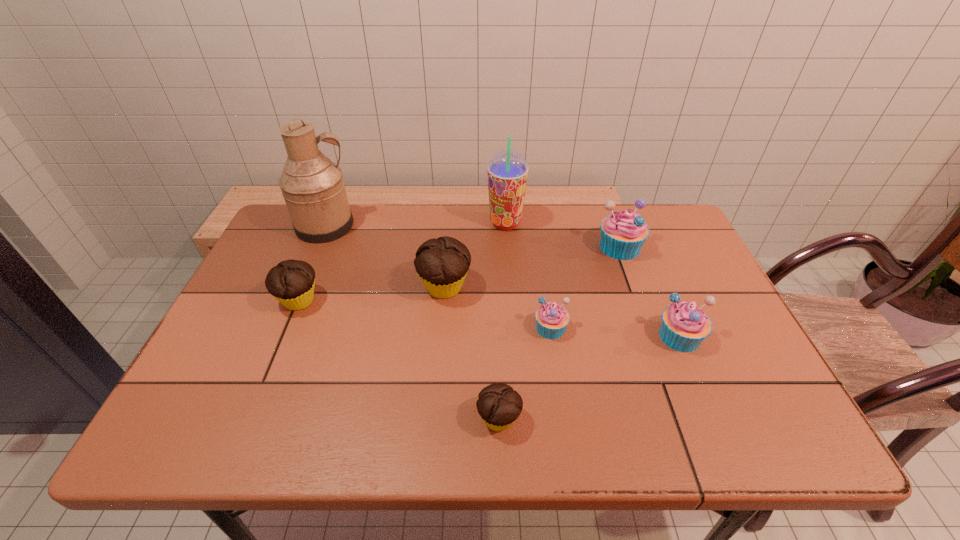
Identify the location of vacant region located 0.170m on the right of the third muffin from left to right. (605, 420).

Locate an element on the screen. The image size is (960, 540). pitcher at the far edge is located at coordinates (313, 188).

In order to click on smoothie present at the far edge in this screenshot , I will do `click(507, 170)`.

I want to click on muffin located at the far edge, so click(623, 233).

Where is `object that is at the near edge`? This screenshot has width=960, height=540. object that is at the near edge is located at coordinates (499, 405).

Identify the location of pitcher that is at the left edge. point(313,188).

The height and width of the screenshot is (540, 960). What are the coordinates of `muffin located at the left edge` in the screenshot? It's located at (291, 282).

At what (x,y) coordinates should I click in order to perform the action: click on object situated at the far left corner. Please return your answer as a coordinate pair (x, y). The width and height of the screenshot is (960, 540). Looking at the image, I should click on (313, 188).

Where is `object positioned at the far right corner`? This screenshot has width=960, height=540. object positioned at the far right corner is located at coordinates (623, 233).

At what (x,y) coordinates should I click in order to perform the action: click on vacant space at the far edge of the desktop. Please return your answer as a coordinate pair (x, y). Looking at the image, I should click on (617, 206).